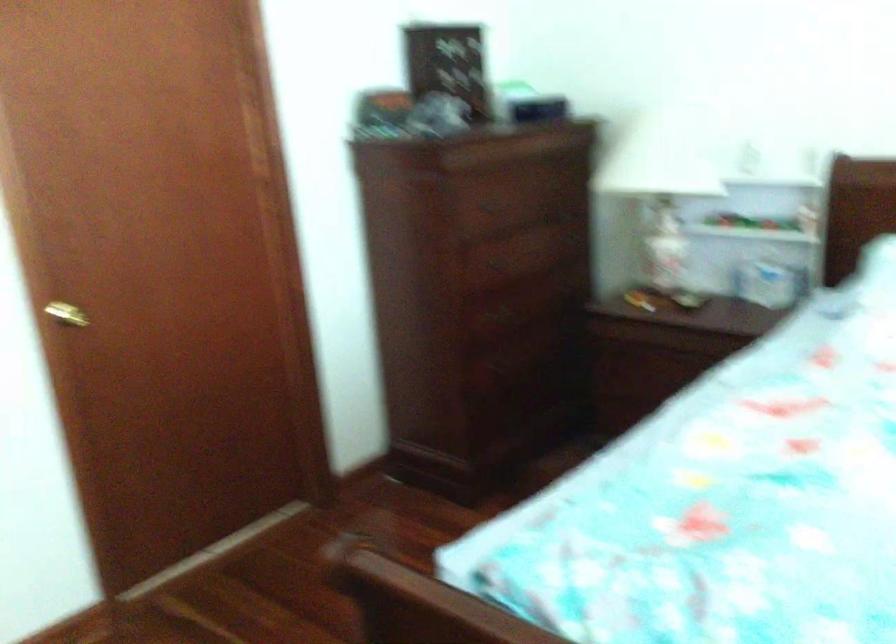
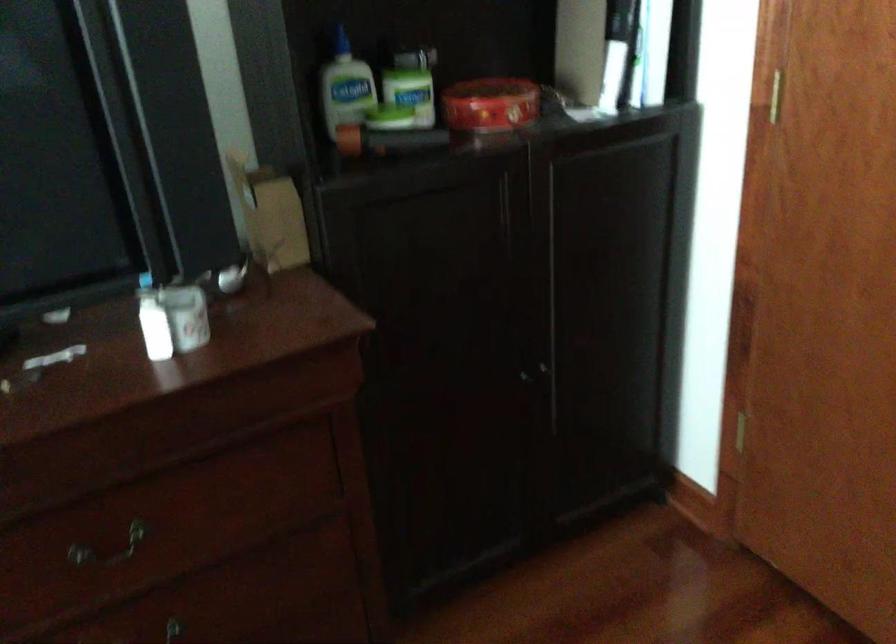
Based on the photo, how did the camera likely rotate?

The rotation direction of the camera is left-down.